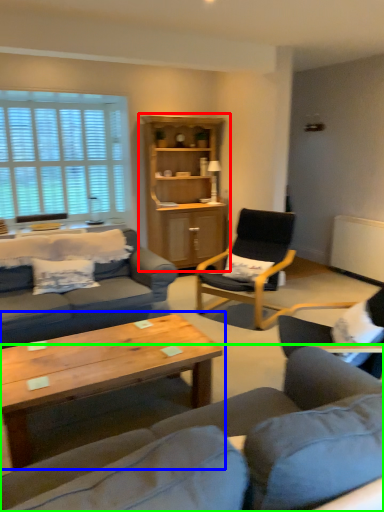
Question: Which object is the farthest from cabinetry (highlighted by a red box)? Choose among these: coffee table (highlighted by a blue box) or studio couch (highlighted by a green box).

Choices:
 (A) coffee table
 (B) studio couch

Answer: (B)